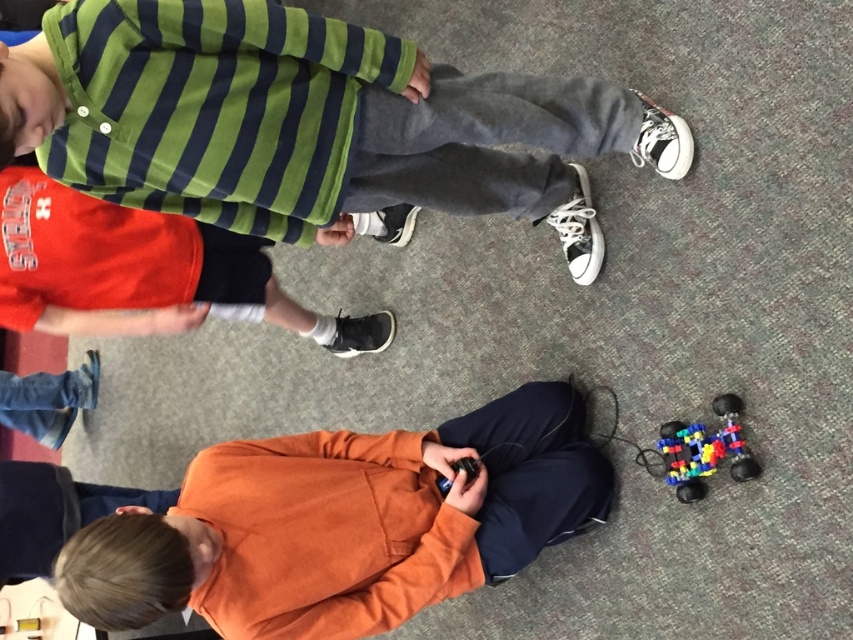
Does matte green striped shirt at upper left appear on the right side of orange fleece shirt at lower center?

Indeed, matte green striped shirt at upper left is positioned on the right side of orange fleece shirt at lower center.

Does point (206, 45) come behind point (241, 445)?

No.

Who is more forward, (x=320, y=138) or (x=148, y=596)?

Point (x=148, y=596) is in front.

The image size is (853, 640). What are the coordinates of `matte green striped shirt at upper left` in the screenshot? It's located at point(305,120).

Is matte green striped shirt at upper left to the right of multicolored plastic toy car at lower right from the viewer's perspective?

No, matte green striped shirt at upper left is not to the right of multicolored plastic toy car at lower right.

Who is shorter, matte green striped shirt at upper left or multicolored plastic toy car at lower right?

Standing shorter between the two is multicolored plastic toy car at lower right.

Which is in front, point (177, 68) or point (682, 472)?

Point (177, 68)

Where is `matte green striped shirt at upper left`? The image size is (853, 640). matte green striped shirt at upper left is located at coordinates (305, 120).

Is matte black shorts at lower left positioned behind multicolored plastic toy car at lower right?

Yes, matte black shorts at lower left is behind multicolored plastic toy car at lower right.

Is point (99, 228) positioned behind point (718, 403)?

Yes, it is behind point (718, 403).

Locate an element on the screen. This screenshot has width=853, height=640. matte black shorts at lower left is located at coordinates (142, 272).